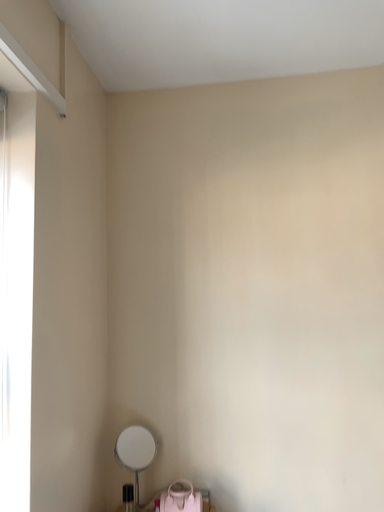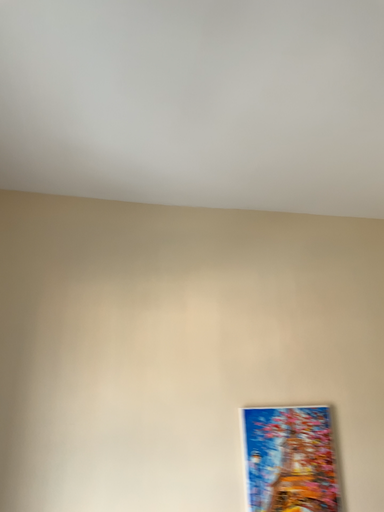
Question: How did the camera likely rotate when shooting the video?

Choices:
 (A) rotated downward
 (B) rotated upward

Answer: (B)